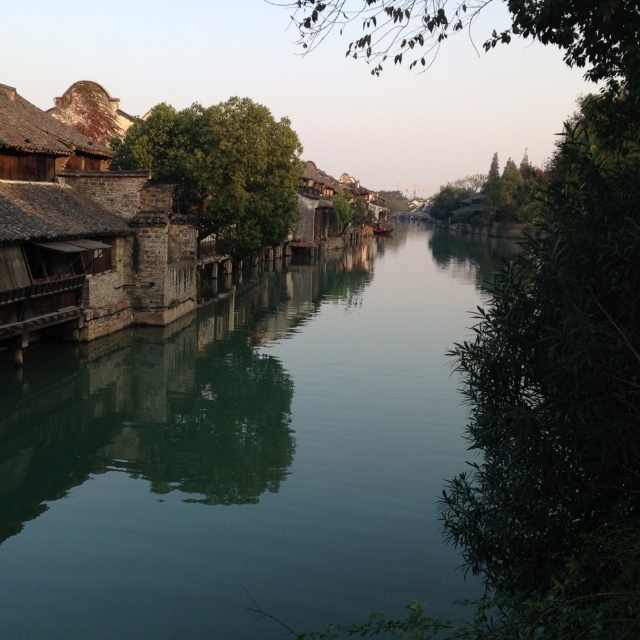
Between rusty metal roof at upper left and green leafy tree at upper right, which one appears on the left side from the viewer's perspective?

Positioned to the left is rusty metal roof at upper left.

Does rusty metal roof at upper left have a smaller size compared to green leafy tree at upper right?

Correct, rusty metal roof at upper left occupies less space than green leafy tree at upper right.

Where is `rusty metal roof at upper left`? rusty metal roof at upper left is located at coordinates (42, 141).

Locate an element on the screen. The width and height of the screenshot is (640, 640). rusty metal roof at upper left is located at coordinates (42, 141).

Is green leafy tree at center right smaller than green leafy tree at upper left?

No, green leafy tree at center right is not smaller than green leafy tree at upper left.

Can you confirm if green leafy tree at center right is thinner than green leafy tree at upper left?

No.

Between point (312, 45) and point (216, 186), which one is positioned in front?

Point (216, 186)

Locate an element on the screen. This screenshot has height=640, width=640. green leafy tree at center right is located at coordinates point(560,369).

Who is more forward, (321, 467) or (225, 104)?

Point (321, 467) is in front.

Between green reflective water at center and green leafy tree at upper left, which one is positioned higher?

Positioned higher is green leafy tree at upper left.

Which is behind, point (444, 348) or point (240, 172)?

The point (444, 348) is behind.

Where is `green reflective water at center`? The image size is (640, 640). green reflective water at center is located at coordinates (246, 456).